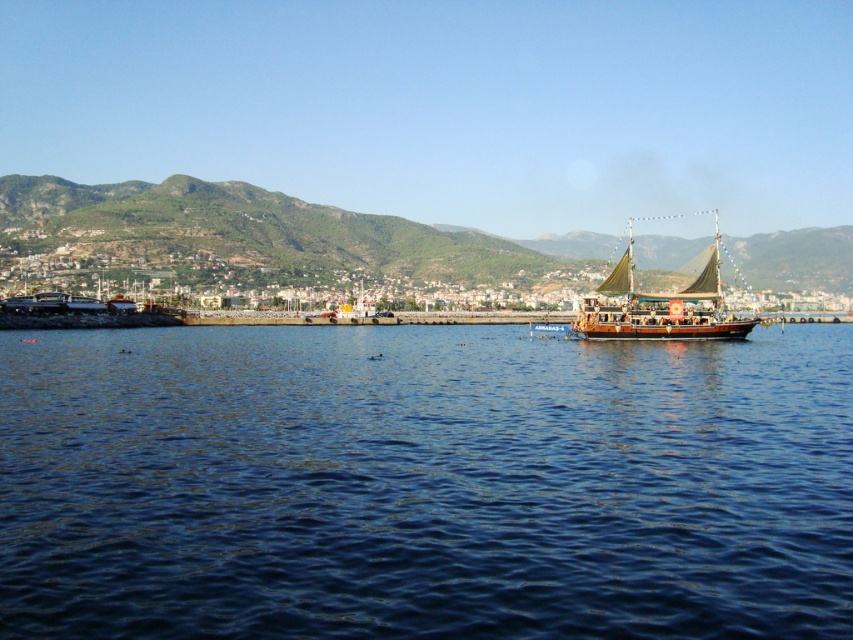
Question: Can you confirm if green textured mountain at upper center is bigger than wooden sailboat at right?

Choices:
 (A) yes
 (B) no

Answer: (A)

Question: Among these objects, which one is nearest to the camera?

Choices:
 (A) blue water at center
 (B) green textured mountain at upper center

Answer: (A)

Question: Which of the following is the farthest from the observer?

Choices:
 (A) (245, 204)
 (B) (631, 252)

Answer: (A)

Question: Where is blue water at center located in relation to green textured mountain at upper center in the image?

Choices:
 (A) left
 (B) right

Answer: (A)

Question: Is blue water at center closer to camera compared to wooden sailboat at right?

Choices:
 (A) no
 (B) yes

Answer: (B)

Question: Which object appears closest to the camera in this image?

Choices:
 (A) blue water at center
 (B) green textured mountain at upper center
 (C) wooden sailboat at right

Answer: (A)